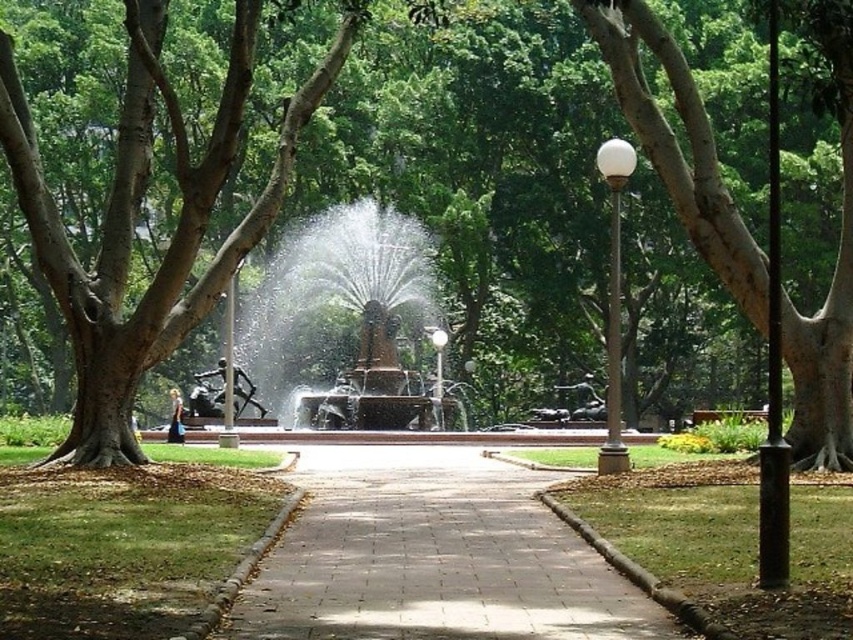
Question: Considering the real-world distances, which object is farthest from the bronze/rough fountain at center?

Choices:
 (A) wooden bench at center
 (B) smooth brown tree trunk at left

Answer: (A)

Question: Is brown textured tree at center below bronze/rough fountain at center?

Choices:
 (A) no
 (B) yes

Answer: (A)

Question: Which object is farther from the camera taking this photo?

Choices:
 (A) wooden bench at center
 (B) paved stone pathway at center
 (C) smooth brown tree trunk at left

Answer: (A)

Question: Is brown textured tree at center positioned behind white glossy lamp post at center right?

Choices:
 (A) yes
 (B) no

Answer: (B)

Question: Is brown textured tree at center positioned before wooden bench at center?

Choices:
 (A) no
 (B) yes

Answer: (B)

Question: Which of the following is the closest to the observer?

Choices:
 (A) smooth brown tree trunk at left
 (B) wooden bench at center
 (C) paved stone pathway at center
 (D) white glossy lamp post at center right

Answer: (C)